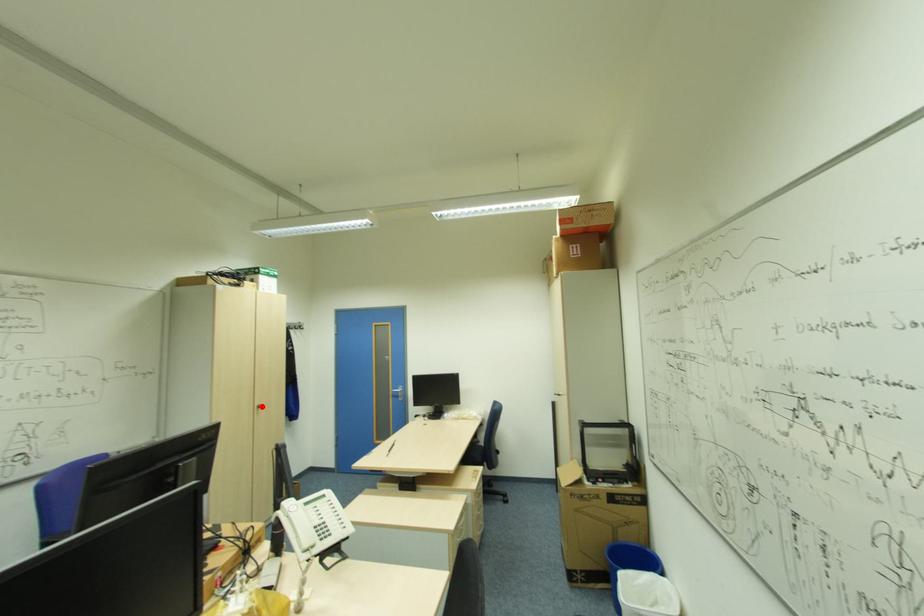
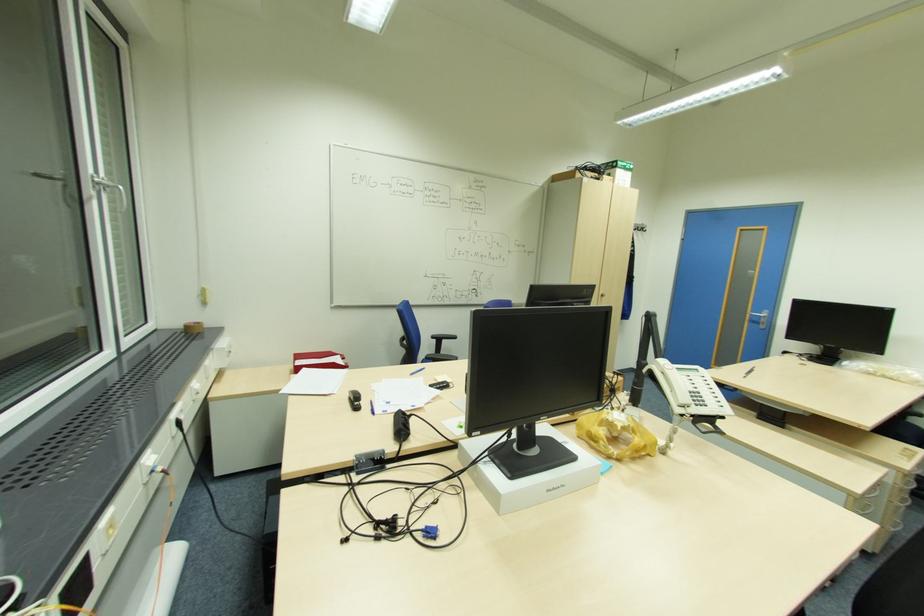
Question: I am providing you with two images of the same scene from different viewpoints. In image1, a red point is highlighted. Considering the same 3D point in image2, which of the following is correct?

Choices:
 (A) It is closer
 (B) It is farther

Answer: (B)